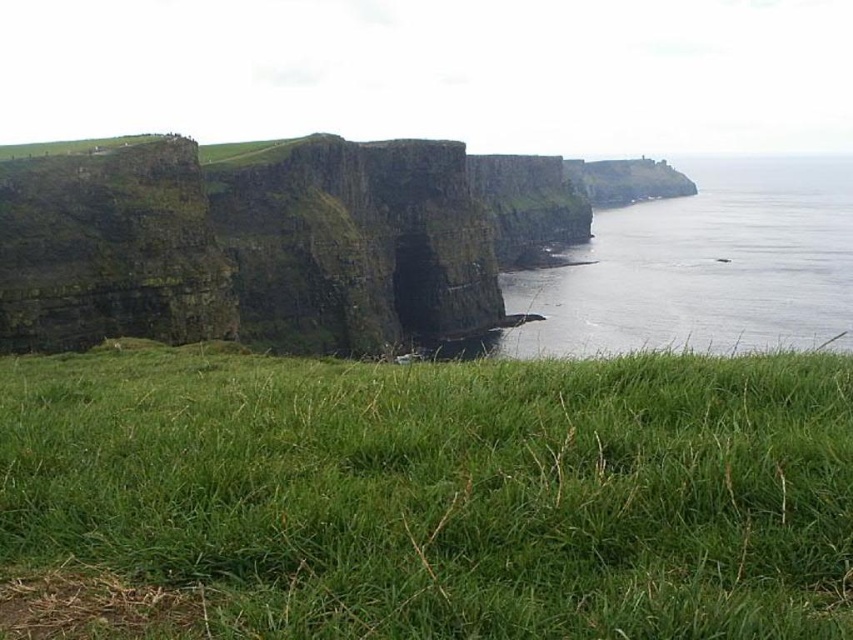
You are standing at the edge of the Cliffs of Moher and want to take a photo of the transparent water at right. To get a better angle, you need to move to the left of the green grassy at lower center. Is this possible given their positions?

Since the green grassy at lower center is already to the left of the transparent water at right, moving further left from the green grassy at lower center would take you away from the transparent water at right. Therefore, you cannot move to the left of the green grassy at lower center to get a better angle of the transparent water at right.

You are standing on the grassy area near the edge of the Cliffs of Moher and want to walk to the water. Based on the image, which direction should you move to reach the transparent water at right from the green grassy at lower center?

The green grassy at lower center is positioned under transparent water at right, so you should move towards the right direction to reach the transparent water at right from the green grassy at lower center.